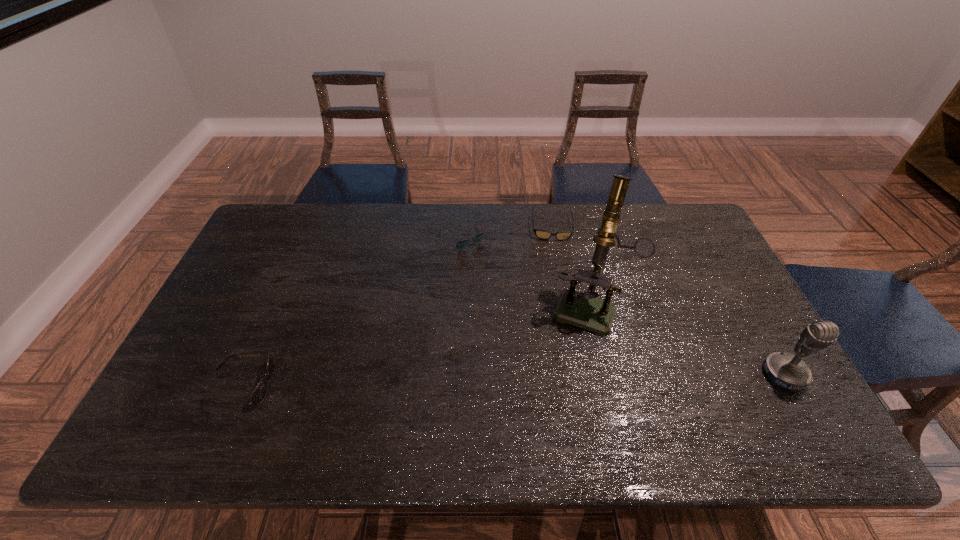
The width and height of the screenshot is (960, 540). In order to click on the leftmost sunglasses in this screenshot , I will do `click(259, 393)`.

Find the location of a particular element. This screenshot has height=540, width=960. the leftmost object is located at coordinates (259, 393).

The image size is (960, 540). In order to click on the rightmost object in this screenshot , I will do `click(785, 370)`.

This screenshot has height=540, width=960. I want to click on microphone, so click(x=785, y=370).

At what (x,y) coordinates should I click in order to perform the action: click on the second sunglasses from right to left. Please return your answer as a coordinate pair (x, y). The width and height of the screenshot is (960, 540). Looking at the image, I should click on tap(460, 245).

This screenshot has width=960, height=540. What are the coordinates of `microscope` in the screenshot? It's located at (583, 309).

I want to click on the third nearest object, so click(583, 309).

The image size is (960, 540). In order to click on the rightmost sunglasses in this screenshot , I will do `click(541, 234)`.

Locate an element on the screen. vacant space located on the front-facing side of the tallest sunglasses is located at coordinates (337, 384).

The image size is (960, 540). Identify the location of vacant space located on the lenses of the second object from left to right. click(x=487, y=266).